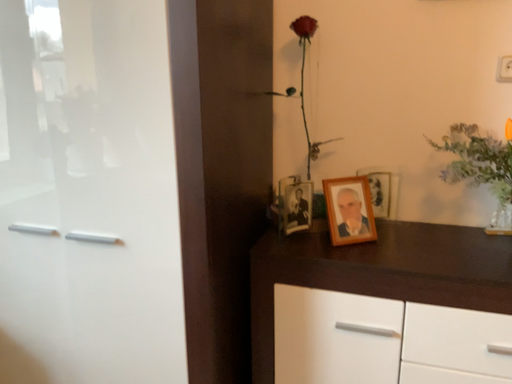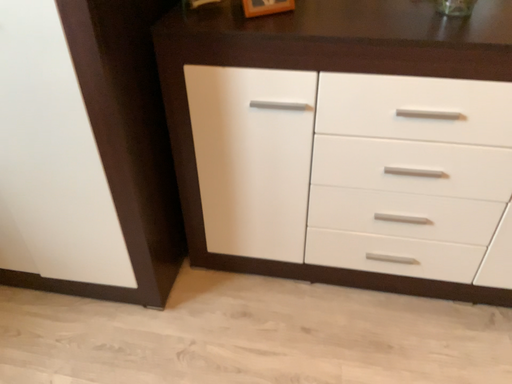
Question: How did the camera likely rotate when shooting the video?

Choices:
 (A) rotated right
 (B) rotated left

Answer: (A)